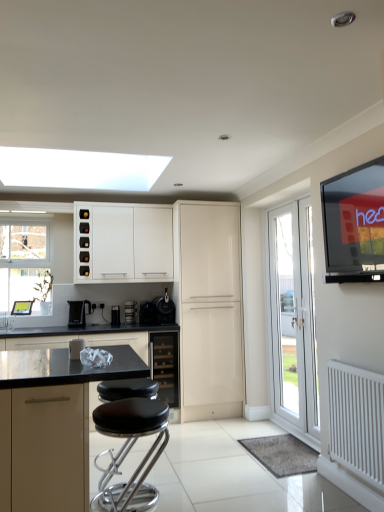
Locate an element on the screen. free space to the left of black plastic toaster at center, the fourth appliance positioned from the right is located at coordinates (107, 325).